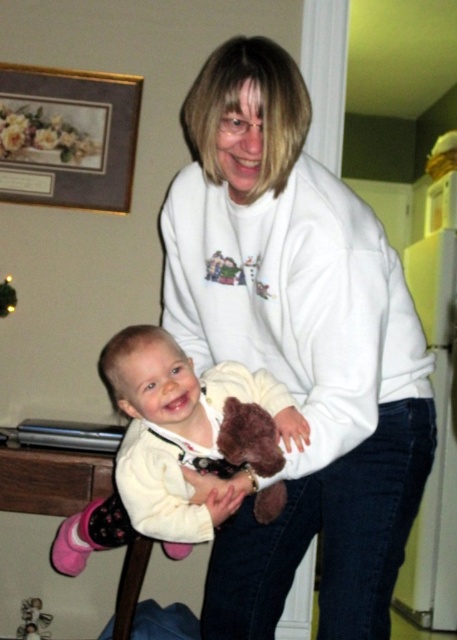
Question: Can you confirm if white fleece sweatshirt at center is positioned to the left of soft plush teddy bear at center?

Choices:
 (A) yes
 (B) no

Answer: (B)

Question: Is white soft teddy bear at lower left positioned at the back of gold-framed floral print at upper left?

Choices:
 (A) no
 (B) yes

Answer: (A)

Question: Based on their relative distances, which object is farther from the gold-framed floral print at upper left?

Choices:
 (A) white soft teddy bear at lower left
 (B) soft plush teddy bear at center

Answer: (B)

Question: Is white soft teddy bear at lower left to the left of gold-framed floral print at upper left from the viewer's perspective?

Choices:
 (A) yes
 (B) no

Answer: (B)

Question: Among these objects, which one is farthest from the camera?

Choices:
 (A) soft plush teddy bear at center
 (B) white fleece sweatshirt at center

Answer: (A)

Question: Which point is farther to the camera?

Choices:
 (A) (27, 636)
 (B) (111, 102)
 (C) (176, 396)

Answer: (B)